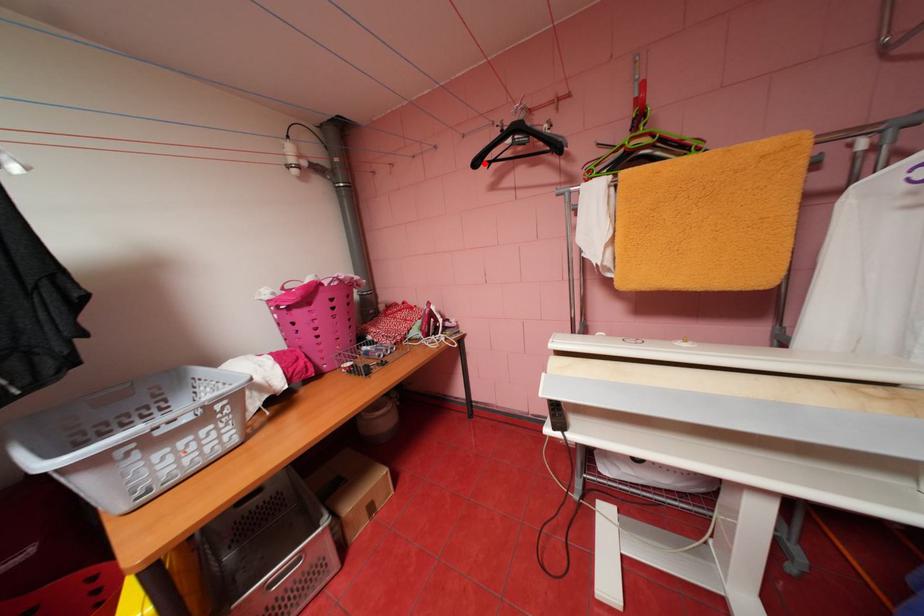
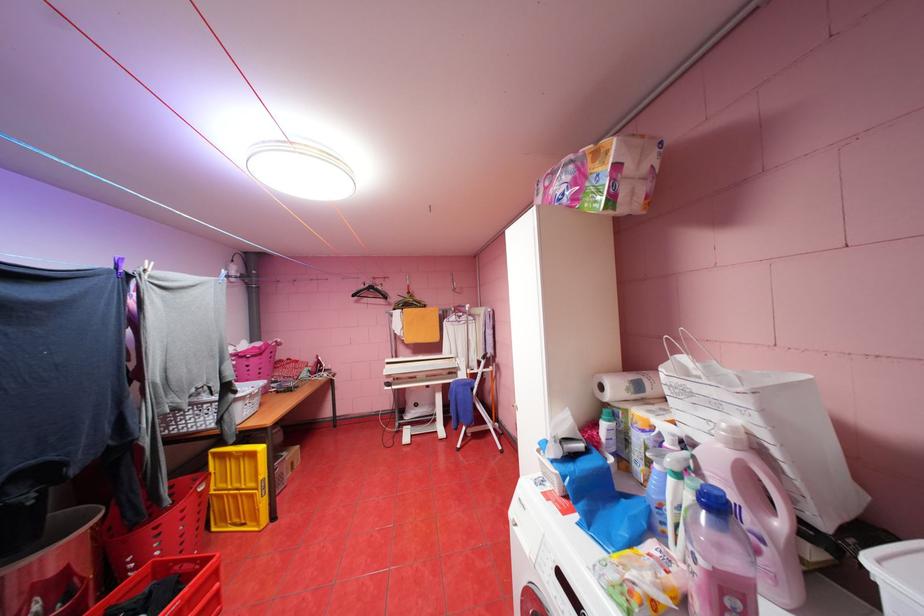
Where in the second image is the point corresponding to the highlighted location from the first image?

(361, 294)